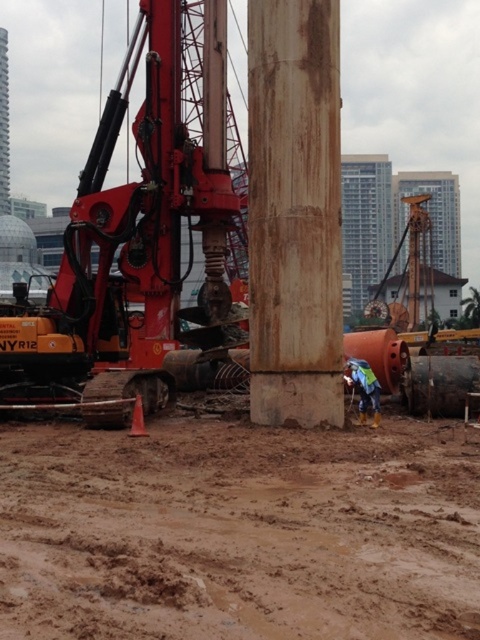
You are operating a forklift that requires a 7 feet turning radius. You need to maneuver around the rusty metal pole at center while staying at least 2 feet away from the blue reflective safety vest at lower right. Is there enough space to make the turn?

The distance between the rusty metal pole at center and the blue reflective safety vest at lower right is 6.95 feet. Since the forklift needs a 7 feet turning radius and must stay 2 feet away from the vest, the available space is insufficient. The total required distance would be 7 feet plus 2 feet, which exceeds the 6.95 feet available. Therefore, there isn not enough space to make the turn safely.